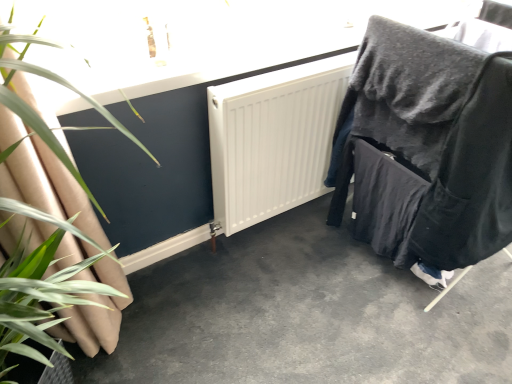
Find the location of a particular element. This screenshot has width=512, height=384. blank space above smooth concrete floor at center (from a real-world perspective) is located at coordinates (305, 307).